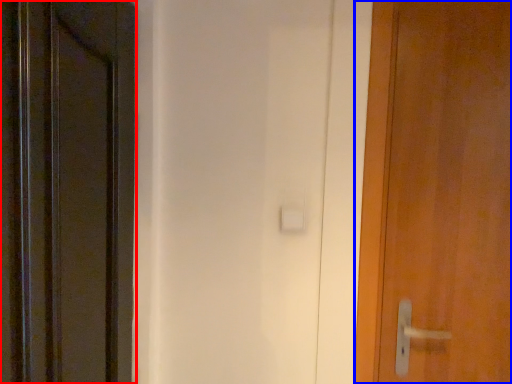
Question: Which point is closer to the camera, door (highlighted by a red box) or door (highlighted by a blue box)?

Choices:
 (A) door
 (B) door

Answer: (A)